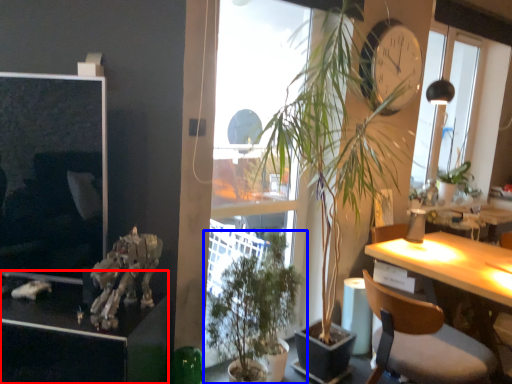
Question: Which point is closer to the camera, cabinetry (highlighted by a red box) or houseplant (highlighted by a blue box)?

Choices:
 (A) cabinetry
 (B) houseplant

Answer: (A)